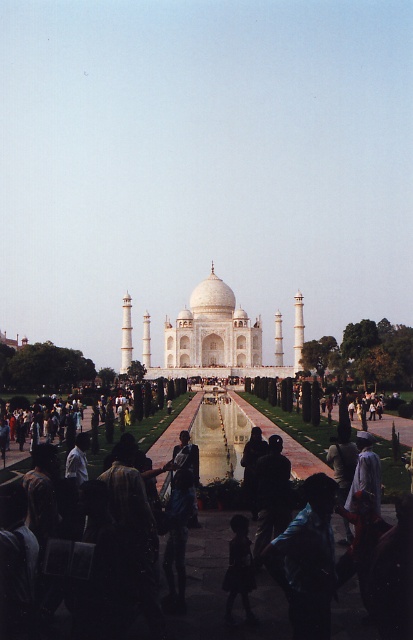
Can you confirm if white marble taj mahal at center is bigger than black fabric at center?

Correct, white marble taj mahal at center is larger in size than black fabric at center.

Can you confirm if white marble taj mahal at center is positioned to the right of black fabric at center?

No, white marble taj mahal at center is not to the right of black fabric at center.

Locate an element on the screen. This screenshot has height=640, width=413. white marble taj mahal at center is located at coordinates (220, 337).